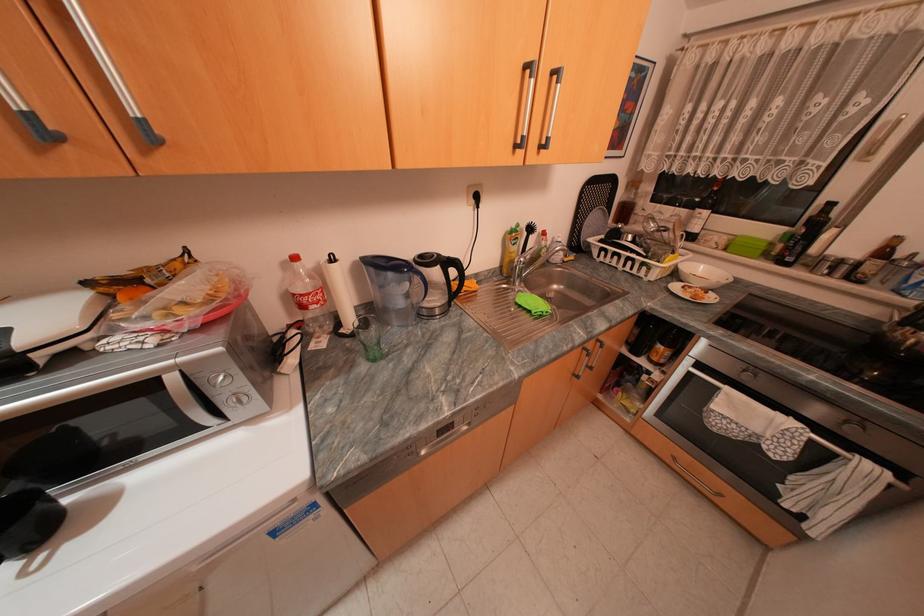
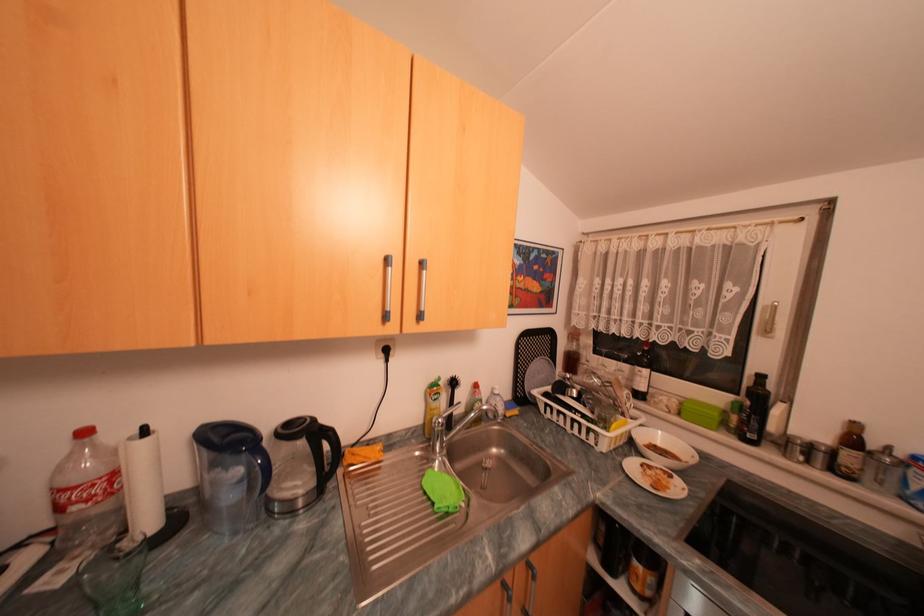
In the second image, find the point that corresponds to point (305, 257) in the first image.

(94, 432)